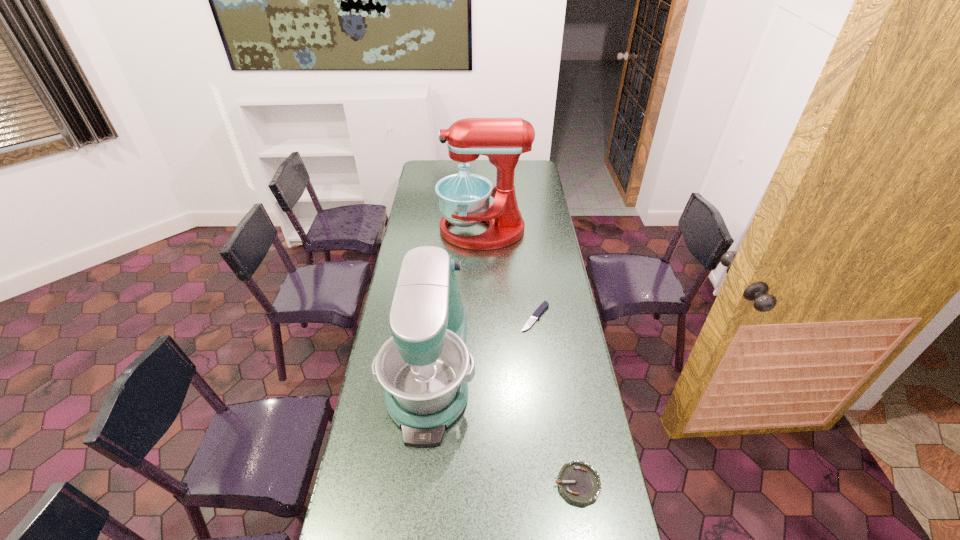
Locate an element on the screen. The image size is (960, 540). vacant space located on the left of the shortest object is located at coordinates (431, 318).

The image size is (960, 540). What are the coordinates of `object that is positioned at the left edge` in the screenshot? It's located at (422, 367).

Identify the location of mixer at the right edge. This screenshot has width=960, height=540. (464, 199).

The height and width of the screenshot is (540, 960). What are the coordinates of `ashtray that is at the right edge` in the screenshot? It's located at (578, 481).

What are the coordinates of `steak knife that is at the right edge` in the screenshot? It's located at (538, 312).

In order to click on vacant point at the left edge in this screenshot , I will do `click(398, 267)`.

Where is `vacant region at the right edge of the desktop`? This screenshot has height=540, width=960. vacant region at the right edge of the desktop is located at coordinates (536, 255).

Find the location of a particular element. This screenshot has width=960, height=540. vacant space at the far right corner of the desktop is located at coordinates (528, 172).

This screenshot has height=540, width=960. In order to click on free spot between the nearest object and the steak knife in this screenshot , I will do `click(556, 401)`.

Find the location of `blank region between the shorter mixer and the second shortest object`. blank region between the shorter mixer and the second shortest object is located at coordinates (504, 427).